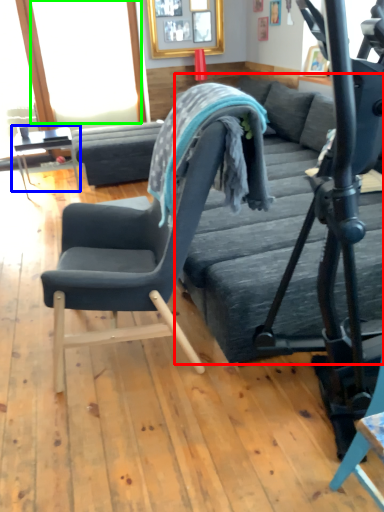
Question: Which object is the closest to the bed frame (highlighted by a red box)? Choose among these: table (highlighted by a blue box) or window screen (highlighted by a green box).

Choices:
 (A) table
 (B) window screen

Answer: (A)